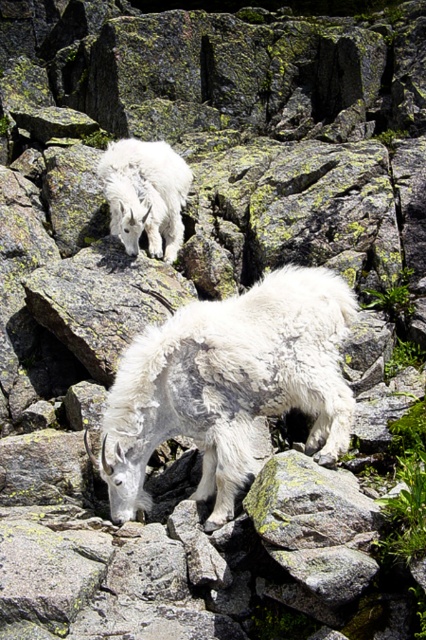
You are a photographer standing at the edge of a rocky terrain. You want to take a photo of the white woolen goat at center. If your camera has a maximum focus range of 6 meters, will you be able to capture it clearly?

The white woolen goat at center is 6.34 meters from camera, which exceeds the camera maximum focus range of 6 meters, so you won not be able to capture it clearly.

You are a hiker trying to navigate the rocky terrain. You see two points marked on the map as point (307, 342) and point (108, 184). Which point should you approach first if you want to reach the nearest point first?

Point (307, 342) is closer to the viewer than point (108, 184), so you should approach point (307, 342) first.

You are a hiker trying to navigate the rocky terrain. You see the white woolen goat at center and the white woolen goat at upper center. Which goat is closer to you?

The white woolen goat at center is closer to you because it is positioned under the white woolen goat at upper center, indicating it is in front.